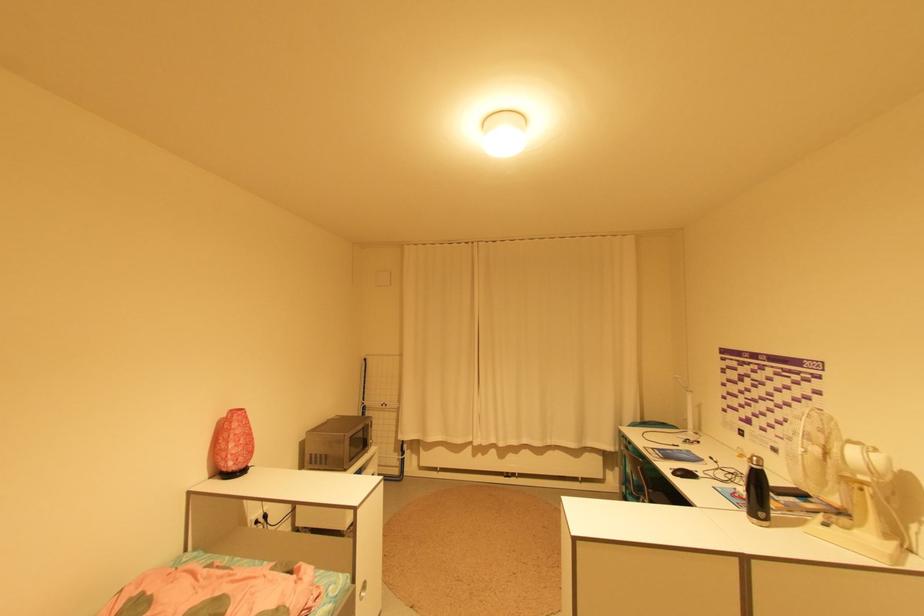
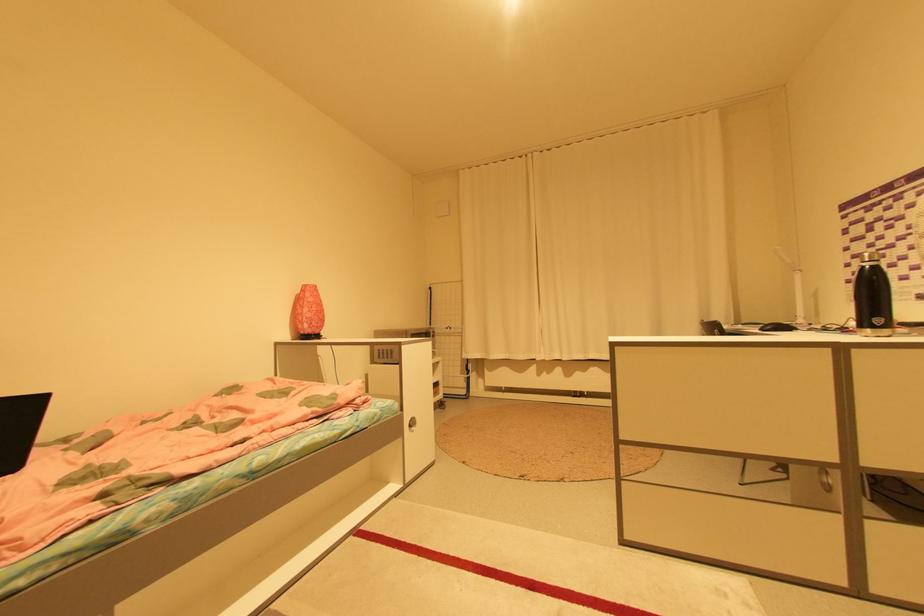
Question: The camera is either moving clockwise (left) or counter-clockwise (right) around the object. The first image is from the beginning of the video and the second image is from the end. Is the camera moving left or right when shooting the video?

Choices:
 (A) Left
 (B) Right

Answer: (B)